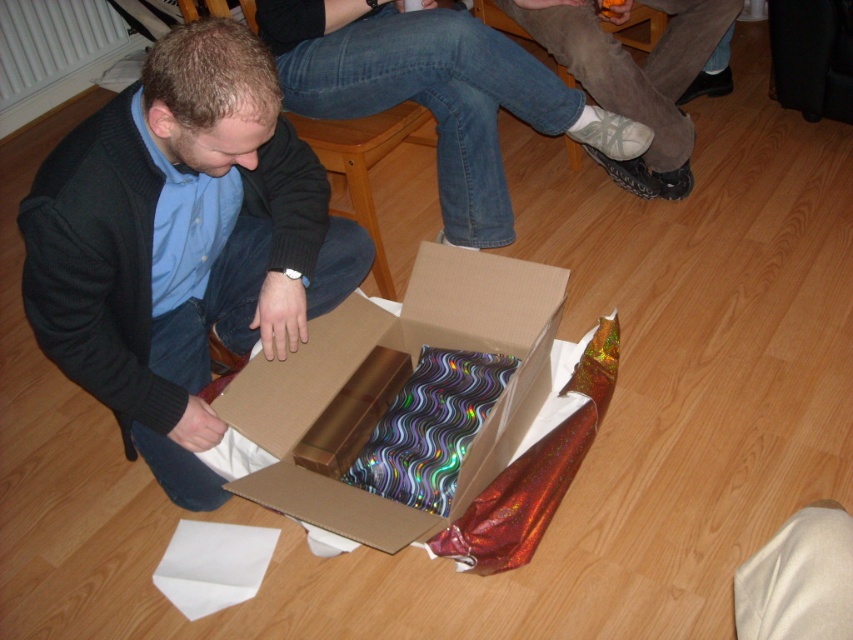
Question: Does matte black sweater at lower left have a larger size compared to white mesh socks at lower center?

Choices:
 (A) no
 (B) yes

Answer: (B)

Question: Which point appears farthest from the camera in this image?

Choices:
 (A) (494, 465)
 (B) (659, 132)

Answer: (B)

Question: Which object is the closest to the white mesh socks at lower center?

Choices:
 (A) matte black sweater at lower left
 (B) cardboard box at lower center

Answer: (B)

Question: Which object is positioned closest to the white mesh socks at lower center?

Choices:
 (A) cardboard box at lower center
 (B) matte black sweater at lower left

Answer: (A)

Question: In this image, where is cardboard box at lower center located relative to white mesh socks at lower center?

Choices:
 (A) above
 (B) below

Answer: (B)

Question: Is matte black sweater at lower left to the left of cardboard box at lower center from the viewer's perspective?

Choices:
 (A) yes
 (B) no

Answer: (A)